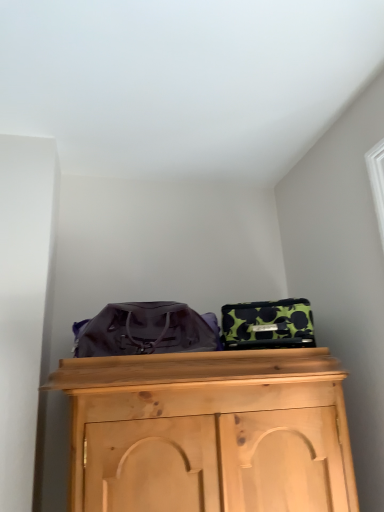
Measure the distance between matte purple messenger bag at center and camera.

The depth of matte purple messenger bag at center is 1.46 meters.

Describe the element at coordinates (145, 330) in the screenshot. The height and width of the screenshot is (512, 384). I see `matte purple messenger bag at center` at that location.

Identify the location of matte purple messenger bag at center. (145, 330).

What do you see at coordinates (268, 324) in the screenshot?
I see `green polka dot fabric suitcase at upper right` at bounding box center [268, 324].

What is the approximate height of green polka dot fabric suitcase at upper right?

green polka dot fabric suitcase at upper right is 8.60 inches in height.

In order to click on green polka dot fabric suitcase at upper right in this screenshot , I will do `click(268, 324)`.

Where is `matte purple messenger bag at center`? matte purple messenger bag at center is located at coordinates (145, 330).

Is green polka dot fabric suitcase at upper right at the right side of matte purple messenger bag at center?

Correct, you'll find green polka dot fabric suitcase at upper right to the right of matte purple messenger bag at center.

Which is behind, green polka dot fabric suitcase at upper right or matte purple messenger bag at center?

Positioned behind is green polka dot fabric suitcase at upper right.

Does point (223, 309) come closer to viewer compared to point (160, 337)?

No.

From the image's perspective, is green polka dot fabric suitcase at upper right below matte purple messenger bag at center?

Yes, from the image's perspective, green polka dot fabric suitcase at upper right is below matte purple messenger bag at center.

From a real-world perspective, is green polka dot fabric suitcase at upper right positioned above or below matte purple messenger bag at center?

green polka dot fabric suitcase at upper right is below matte purple messenger bag at center.

Looking at their sizes, would you say green polka dot fabric suitcase at upper right is wider or thinner than matte purple messenger bag at center?

green polka dot fabric suitcase at upper right is thinner than matte purple messenger bag at center.

Which of these two, green polka dot fabric suitcase at upper right or matte purple messenger bag at center, stands taller?

matte purple messenger bag at center is taller.

Considering the sizes of green polka dot fabric suitcase at upper right and matte purple messenger bag at center in the image, is green polka dot fabric suitcase at upper right bigger or smaller than matte purple messenger bag at center?

Considering their sizes, green polka dot fabric suitcase at upper right takes up less space than matte purple messenger bag at center.

Is green polka dot fabric suitcase at upper right positioned beyond the bounds of matte purple messenger bag at center?

Yes, green polka dot fabric suitcase at upper right is outside of matte purple messenger bag at center.

Is green polka dot fabric suitcase at upper right far away from matte purple messenger bag at center?

No, green polka dot fabric suitcase at upper right is in close proximity to matte purple messenger bag at center.

Is green polka dot fabric suitcase at upper right turned away from matte purple messenger bag at center?

No, green polka dot fabric suitcase at upper right's orientation is not away from matte purple messenger bag at center.

How different are the orientations of green polka dot fabric suitcase at upper right and matte purple messenger bag at center in degrees?

green polka dot fabric suitcase at upper right and matte purple messenger bag at center are facing 0.000775 degrees away from each other.

I want to click on luggage behind the matte purple messenger bag at center, so click(x=268, y=324).

Which is more to the left, matte purple messenger bag at center or green polka dot fabric suitcase at upper right?

matte purple messenger bag at center.

Is matte purple messenger bag at center further to camera compared to green polka dot fabric suitcase at upper right?

No, the depth of matte purple messenger bag at center is less than that of green polka dot fabric suitcase at upper right.

Which is farther, (96, 338) or (276, 316)?

The point (276, 316) is more distant.

From the image's perspective, is matte purple messenger bag at center above green polka dot fabric suitcase at upper right?

Yes.

From a real-world perspective, is matte purple messenger bag at center physically above green polka dot fabric suitcase at upper right?

Yes, from a real-world perspective, matte purple messenger bag at center is on top of green polka dot fabric suitcase at upper right.

Is matte purple messenger bag at center wider than green polka dot fabric suitcase at upper right?

Indeed, matte purple messenger bag at center has a greater width compared to green polka dot fabric suitcase at upper right.

Is matte purple messenger bag at center taller or shorter than green polka dot fabric suitcase at upper right?

Clearly, matte purple messenger bag at center is taller compared to green polka dot fabric suitcase at upper right.

Which of these two, matte purple messenger bag at center or green polka dot fabric suitcase at upper right, is smaller?

green polka dot fabric suitcase at upper right.

Would you say matte purple messenger bag at center is inside or outside green polka dot fabric suitcase at upper right?

matte purple messenger bag at center is spatially situated outside green polka dot fabric suitcase at upper right.

Is the surface of matte purple messenger bag at center in direct contact with green polka dot fabric suitcase at upper right?

matte purple messenger bag at center is not next to green polka dot fabric suitcase at upper right, and they're not touching.

Looking at this image, is matte purple messenger bag at center facing towards green polka dot fabric suitcase at upper right?

No, matte purple messenger bag at center is not turned towards green polka dot fabric suitcase at upper right.

How many degrees apart are the facing directions of matte purple messenger bag at center and green polka dot fabric suitcase at upper right?

The angular difference between matte purple messenger bag at center and green polka dot fabric suitcase at upper right is 0.000775 degrees.

How much distance is there between matte purple messenger bag at center and green polka dot fabric suitcase at upper right?

matte purple messenger bag at center and green polka dot fabric suitcase at upper right are 10.09 inches apart.

There is a green polka dot fabric suitcase at upper right. Where is `messenger bag above it (from a real-world perspective)`? messenger bag above it (from a real-world perspective) is located at coordinates (145, 330).

Where is `luggage below the matte purple messenger bag at center (from the image's perspective)`? luggage below the matte purple messenger bag at center (from the image's perspective) is located at coordinates (268, 324).

At what (x,y) coordinates should I click in order to perform the action: click on messenger bag above the green polka dot fabric suitcase at upper right (from a real-world perspective). Please return your answer as a coordinate pair (x, y). This screenshot has height=512, width=384. Looking at the image, I should click on (145, 330).